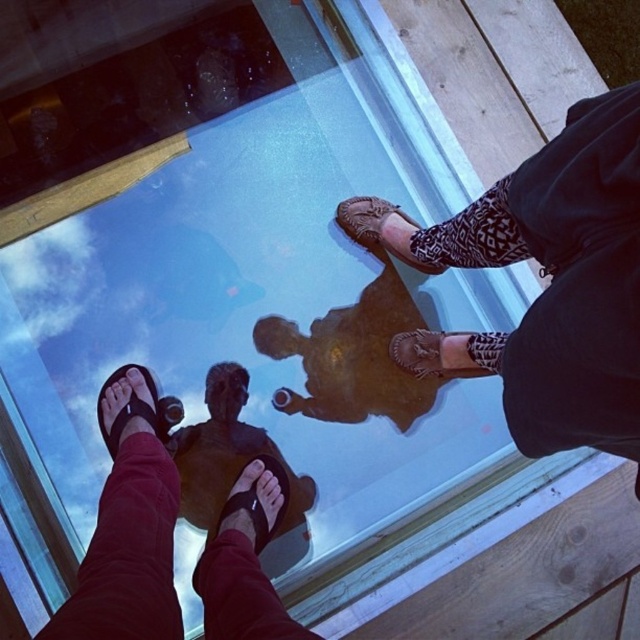
You are standing on the glass floor and see the black matte sandals at lower left and the black leather sandal at lower center. Which pair of shoes is nearer to you?

The black matte sandals at lower left are closer to the viewer than the black leather sandal at lower center, so the black matte sandals at lower left are nearer to you.

You are standing on the glass floor and see your reflection. You notice a point marked at coordinates (257, 499). What object is located at this point in the reflection?

The point at coordinates (257, 499) indicates the location of the black leather sandal at lower center in the reflection.

You are a delivery robot that needs to move between the two shoes on the glass floor. The robot is 8 inches wide. Can you fit through the space between the black matte sandals at lower left and the black leather sandal at lower left?

The space between the black matte sandals at lower left and the black leather sandal at lower left is 8.08 inches, which is slightly wider than the robot. Therefore, the robot can fit through the space between the black matte sandals at lower left and the black leather sandal at lower left.